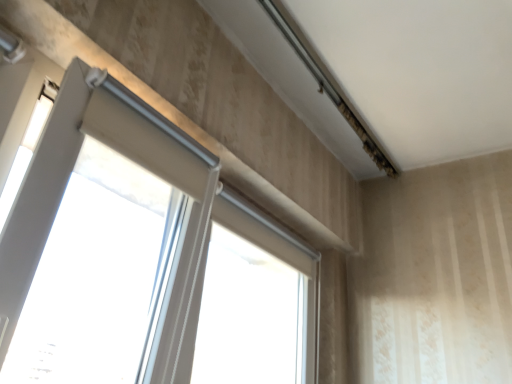
Find the location of `white matte window at center`. white matte window at center is located at coordinates click(x=144, y=258).

The image size is (512, 384). Describe the element at coordinates (144, 258) in the screenshot. I see `white matte window at center` at that location.

Looking at this image, what is the approximate height of white matte window at center?

24.13 inches.

I want to click on white matte window at center, so click(x=144, y=258).